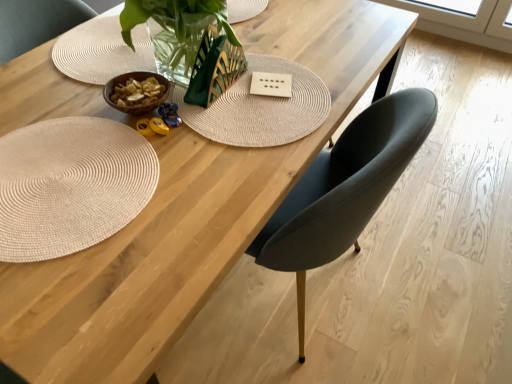
Question: In terms of height, does natural woven mat at lower left look taller or shorter compared to white matte card at center?

Choices:
 (A) short
 (B) tall

Answer: (B)

Question: In terms of size, does natural woven mat at lower left appear bigger or smaller than white matte card at center?

Choices:
 (A) big
 (B) small

Answer: (A)

Question: Considering their positions, is natural woven mat at lower left located in front of or behind white matte card at center?

Choices:
 (A) front
 (B) behind

Answer: (A)

Question: Choose the correct answer: Is white matte card at center inside natural woven mat at lower left or outside it?

Choices:
 (A) outside
 (B) inside

Answer: (A)

Question: From a real-world perspective, relative to natural woven mat at lower left, is white matte card at center vertically above or below?

Choices:
 (A) below
 (B) above

Answer: (A)

Question: Is white matte card at center wider or thinner than natural woven mat at lower left?

Choices:
 (A) thin
 (B) wide

Answer: (A)

Question: From the image's perspective, is white matte card at center positioned above or below natural woven mat at lower left?

Choices:
 (A) above
 (B) below

Answer: (A)